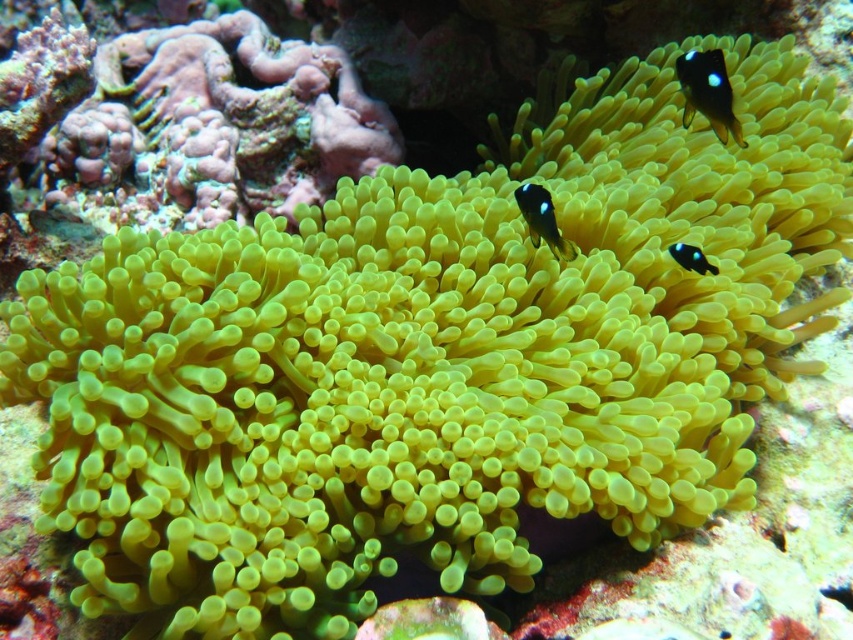
Question: Which point is farther to the camera?

Choices:
 (A) (691, 250)
 (B) (558, 248)
 (C) (674, 61)

Answer: (C)

Question: Does black glossy fish at center appear on the left side of blue glossy fish at center?

Choices:
 (A) yes
 (B) no

Answer: (A)

Question: Which point is closer to the camera taking this photo?

Choices:
 (A) (743, 141)
 (B) (573, 244)

Answer: (B)

Question: Which is farther from the black glossy fish at upper right?

Choices:
 (A) black glossy fish at center
 (B) blue glossy fish at center

Answer: (A)

Question: Does black glossy fish at upper right have a lesser width compared to black glossy fish at center?

Choices:
 (A) no
 (B) yes

Answer: (A)

Question: Can you confirm if black glossy fish at upper right is smaller than blue glossy fish at center?

Choices:
 (A) no
 (B) yes

Answer: (A)